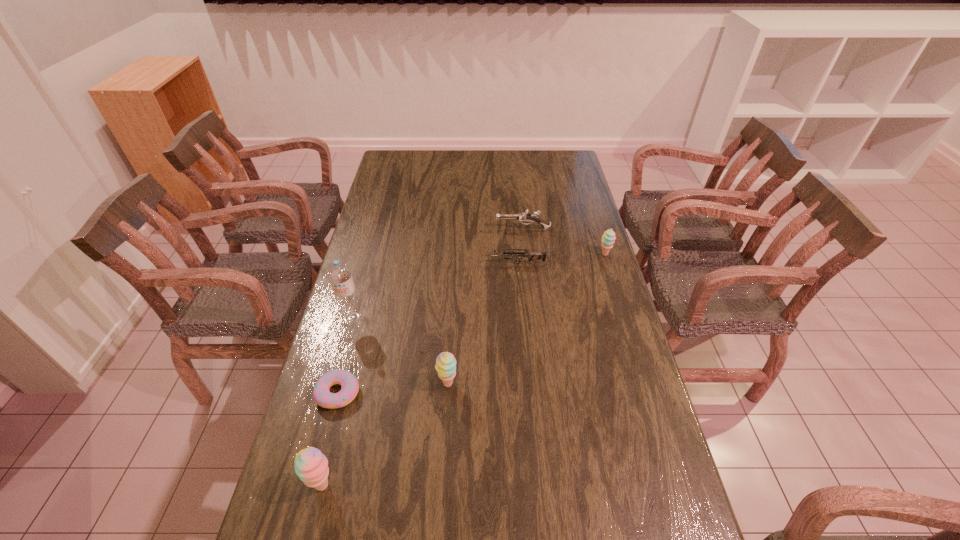
At what (x,y) coordinates should I click in order to perform the action: click on the tallest object. Please return your answer as a coordinate pair (x, y). The height and width of the screenshot is (540, 960). Looking at the image, I should click on (339, 274).

At what (x,y) coordinates should I click in order to perform the action: click on the fourth nearest object. Please return your answer as a coordinate pair (x, y). This screenshot has height=540, width=960. Looking at the image, I should click on (339, 274).

Locate an element on the screen. the shortest object is located at coordinates (322, 396).

The image size is (960, 540). Find the location of `vacant space located 0.220m on the right of the nearest sherbert`. vacant space located 0.220m on the right of the nearest sherbert is located at coordinates (431, 485).

You are a GUI agent. You are given a task and a screenshot of the screen. Output one action in this format:
    pyautogui.click(x=<x>, y=<y>)
    Task: Click on the free space located on the left of the second tallest sherbert
    This screenshot has height=540, width=960.
    Given the screenshot: What is the action you would take?
    pyautogui.click(x=395, y=383)

Find the location of a particular element. vacant region located 0.060m on the back of the fourth shortest object is located at coordinates (601, 240).

Find the location of a particular element. free location located aimed along the barrel of the fifth nearest object is located at coordinates (390, 264).

In order to click on free location located aimed along the barrel of the fifth nearest object in this screenshot , I will do `click(469, 264)`.

You are a GUI agent. You are given a task and a screenshot of the screen. Output one action in this format:
    pyautogui.click(x=<x>, y=<y>)
    Task: Click on the vacant space positioned aimed along the barrel of the fifth nearest object
    
    Given the screenshot: What is the action you would take?
    pyautogui.click(x=469, y=264)

You are a GUI agent. You are given a task and a screenshot of the screen. Output one action in this format:
    pyautogui.click(x=<x>, y=<y>)
    Task: Click on the vacant area situated 0.370m aimed along the barrel of the farthest object
    This screenshot has width=960, height=540.
    Given the screenshot: What is the action you would take?
    pyautogui.click(x=403, y=229)